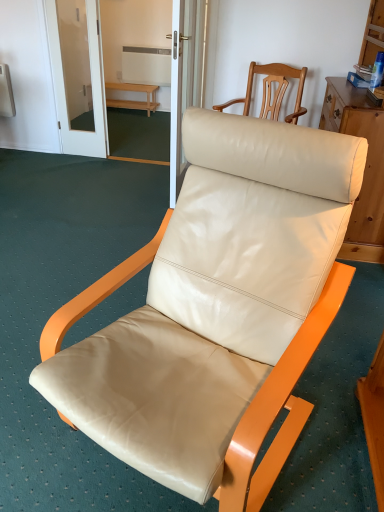
Question: In terms of size, does beige leather chair at upper right, arranged as the 2th chair when ordered from the bottom, appear bigger or smaller than transparent glass screen door at upper center?

Choices:
 (A) small
 (B) big

Answer: (B)

Question: Relative to transparent glass screen door at upper center, is beige leather chair at upper right, positioned as the 1th chair in top-to-bottom order, in front or behind?

Choices:
 (A) behind
 (B) front

Answer: (B)

Question: Estimate the real-world distances between objects in this image. Which object is closer to the beige leather chair at center, which is the second chair in back-to-front order?

Choices:
 (A) light wood bench at center
 (B) transparent glass screen door at upper center
 (C) beige leather chair at upper right, positioned as the 1th chair in top-to-bottom order

Answer: (C)

Question: Based on their relative distances, which object is nearer to the beige leather chair at center, which is the second chair in back-to-front order?

Choices:
 (A) light wood bench at center
 (B) transparent glass screen door at upper center
 (C) beige leather chair at upper right, the second chair positioned from the front

Answer: (C)